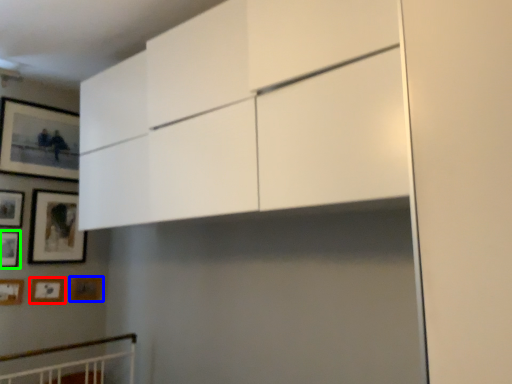
Question: Considering the real-world distances, which object is closest to picture frame (highlighted by a red box)? picture frame (highlighted by a blue box) or picture frame (highlighted by a green box).

Choices:
 (A) picture frame
 (B) picture frame

Answer: (A)